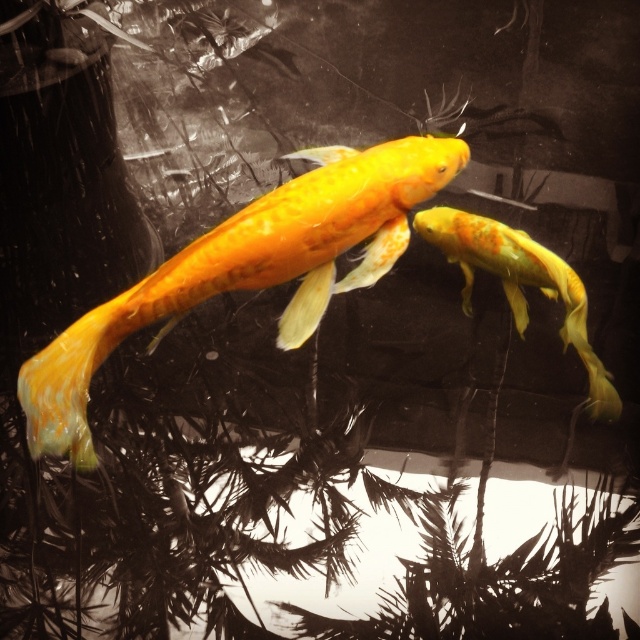
Question: Can you confirm if shiny yellow fish at center is positioned above shiny orange goldfish at center?

Choices:
 (A) yes
 (B) no

Answer: (B)

Question: Which of the following is the closest to the observer?

Choices:
 (A) shiny orange goldfish at center
 (B) shiny yellow fish at center

Answer: (B)

Question: Is shiny yellow fish at center bigger than shiny orange goldfish at center?

Choices:
 (A) yes
 (B) no

Answer: (A)

Question: Can you confirm if shiny yellow fish at center is thinner than shiny orange goldfish at center?

Choices:
 (A) yes
 (B) no

Answer: (B)

Question: Which point is farther to the camera?

Choices:
 (A) (465, 282)
 (B) (83, 369)

Answer: (A)

Question: Which of the following is the closest to the observer?

Choices:
 (A) click(564, 298)
 (B) click(326, 148)

Answer: (B)